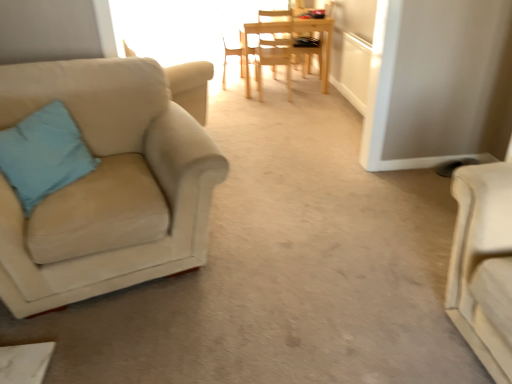
Question: Is wooden chair at center, the 1th chair in the back-to-front sequence, inside or outside of wooden chair at center, which is the second chair in back-to-front order?

Choices:
 (A) outside
 (B) inside

Answer: (A)

Question: Would you say wooden chair at center, the 1th chair in the back-to-front sequence, is to the left or to the right of wooden chair at center, acting as the 4th chair starting from the front, in the picture?

Choices:
 (A) right
 (B) left

Answer: (A)

Question: Considering the real-world distances, which object is farthest from the wooden chair at center, acting as the 4th chair starting from the front?

Choices:
 (A) light wood chair at center, which is counted as the fourth chair, starting from the back
 (B) blue fabric pillow at left
 (C) wooden chair at center, the 1th chair in the back-to-front sequence
 (D) light wood chair at center, acting as the 3th chair starting from the front
 (E) suede beige armchair at left, which ranks as the 5th chair in back-to-front order

Answer: (B)

Question: Which object is the closest to the light wood chair at center, which is counted as the fourth chair, starting from the back?

Choices:
 (A) wooden chair at center, which is the second chair in back-to-front order
 (B) suede beige armchair at left, which ranks as the 1th chair in front-to-back order
 (C) light wood chair at center, the third chair in the back-to-front sequence
 (D) blue fabric pillow at left
 (E) wooden chair at center, the 5th chair viewed from the front

Answer: (A)